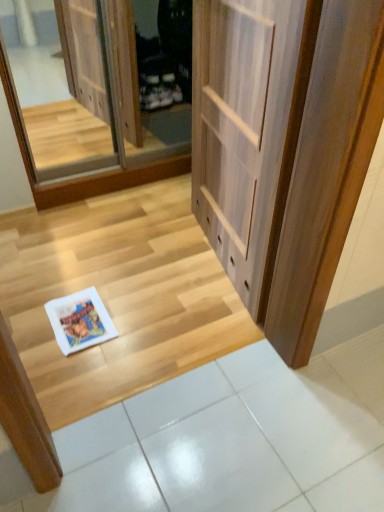
Question: Is wooden floor at lower left wider or thinner than light wood door at center?

Choices:
 (A) wide
 (B) thin

Answer: (A)

Question: Considering the positions of wooden floor at lower left and light wood door at center in the image, is wooden floor at lower left bigger or smaller than light wood door at center?

Choices:
 (A) small
 (B) big

Answer: (A)

Question: Which is nearer to the clear glass screen door at upper left?

Choices:
 (A) white glossy tile at lower center
 (B) white paper magazine at lower left
 (C) wooden floor at lower left
 (D) light wood door at center

Answer: (C)

Question: Which object is positioned closest to the light wood door at center?

Choices:
 (A) white paper magazine at lower left
 (B) wooden floor at lower left
 (C) white glossy tile at lower center
 (D) clear glass screen door at upper left

Answer: (B)